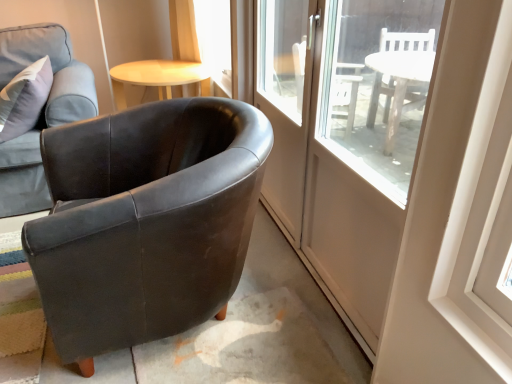
Question: Can you confirm if matte black armchair at left, the first chair in the left-to-right sequence, is bigger than clear glass door at center?

Choices:
 (A) yes
 (B) no

Answer: (A)

Question: Is matte black armchair at left, which is the second chair from right to left, outside of clear glass door at center?

Choices:
 (A) yes
 (B) no

Answer: (A)

Question: Can you confirm if matte black armchair at left, the first chair in the left-to-right sequence, is wider than clear glass door at center?

Choices:
 (A) no
 (B) yes

Answer: (B)

Question: From the image's perspective, is matte black armchair at left, the first chair in the left-to-right sequence, below clear glass door at center?

Choices:
 (A) no
 (B) yes

Answer: (A)

Question: From the image's perspective, is matte black armchair at left, which is the second chair from right to left, on top of clear glass door at center?

Choices:
 (A) no
 (B) yes

Answer: (B)

Question: From a real-world perspective, is clear glass door at center positioned above or below matte black armchair at left, the first chair in the left-to-right sequence?

Choices:
 (A) above
 (B) below

Answer: (A)

Question: Is clear glass door at center to the left or to the right of matte black armchair at left, the first chair in the left-to-right sequence, in the image?

Choices:
 (A) left
 (B) right

Answer: (B)

Question: Based on their sizes in the image, would you say clear glass door at center is bigger or smaller than matte black armchair at left, which is the second chair from right to left?

Choices:
 (A) small
 (B) big

Answer: (A)

Question: Is clear glass door at center wider or thinner than matte black armchair at left, the first chair in the left-to-right sequence?

Choices:
 (A) wide
 (B) thin

Answer: (B)

Question: Considering the positions of point (35, 56) and point (211, 163), is point (35, 56) closer or farther from the camera than point (211, 163)?

Choices:
 (A) farther
 (B) closer

Answer: (A)

Question: Relative to matte black armchair at left, which is counted as the 2th chair, starting from the left, is matte black armchair at left, which is the second chair from right to left, in front or behind?

Choices:
 (A) front
 (B) behind

Answer: (B)

Question: From the image's perspective, is matte black armchair at left, the first chair in the left-to-right sequence, above or below matte black armchair at left, which is counted as the 2th chair, starting from the left?

Choices:
 (A) above
 (B) below

Answer: (A)

Question: From a real-world perspective, relative to matte black armchair at left, which is counted as the 2th chair, starting from the left, is matte black armchair at left, which is the second chair from right to left, vertically above or below?

Choices:
 (A) above
 (B) below

Answer: (A)

Question: In the image, is light wood/woodenobject at upper center on the left side or the right side of matte black armchair at left, which is counted as the 2th chair, starting from the left?

Choices:
 (A) right
 (B) left

Answer: (B)

Question: Relative to matte black armchair at left, which appears as the first chair when viewed from the right, is light wood/woodenobject at upper center in front or behind?

Choices:
 (A) front
 (B) behind

Answer: (B)